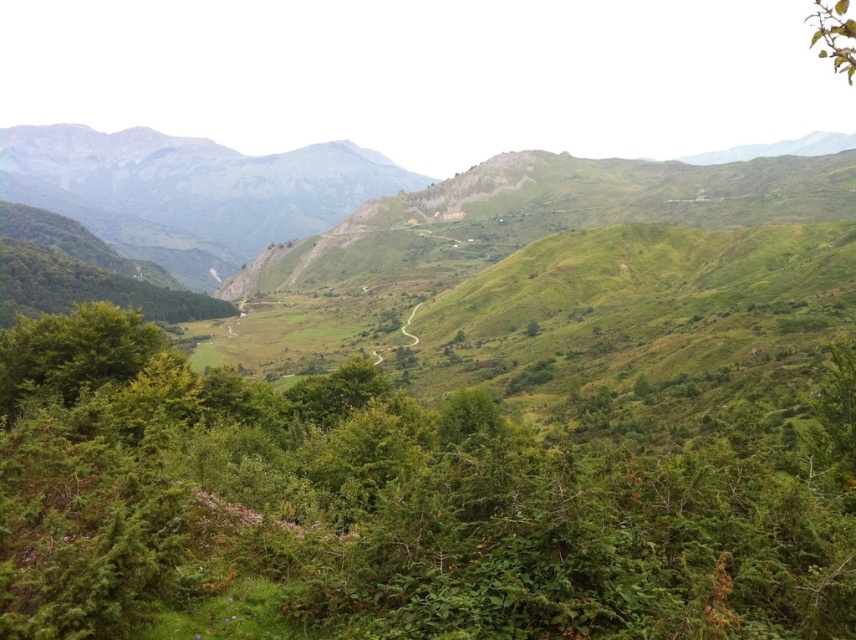
You are standing at the start of the winding dirt path in the midground and want to walk towards the mountains in the background. Which object, the green leafy shrub at center or the green leafy branch at upper right, will you pass closer to as you walk along the path?

The green leafy shrub at center will be closer to you as you walk along the path because it has a lesser width compared to the green leafy branch at upper right, indicating it is smaller and likely positioned closer to the foreground.

You are standing at the base of the valley and looking towards the mountains. You see a green leafy shrub at center and a green leafy branch at upper right. Which of these two objects is closer to you?

The green leafy shrub at center is closer to you because it is located below the green leafy branch at upper right, indicating it is positioned in front of the branch in the scene.

You are standing at the point with coordinates point (851, 19) and want to walk to the point with coordinates point (55, 515). Which direction should you move in relative to the landscape?

You should move forward because point (55, 515) is in front of point (851, 19).